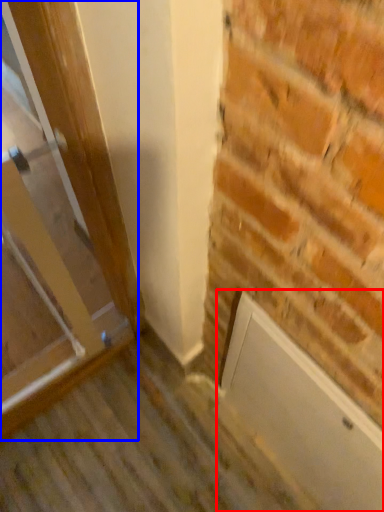
Question: Which of the following is the closest to the observer, screen door (highlighted by a red box) or door (highlighted by a blue box)?

Choices:
 (A) screen door
 (B) door

Answer: (B)